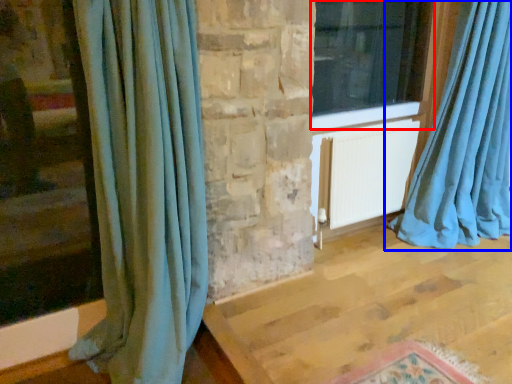
Question: Which object appears farthest to the camera in this image, window (highlighted by a red box) or curtain (highlighted by a blue box)?

Choices:
 (A) window
 (B) curtain

Answer: (A)